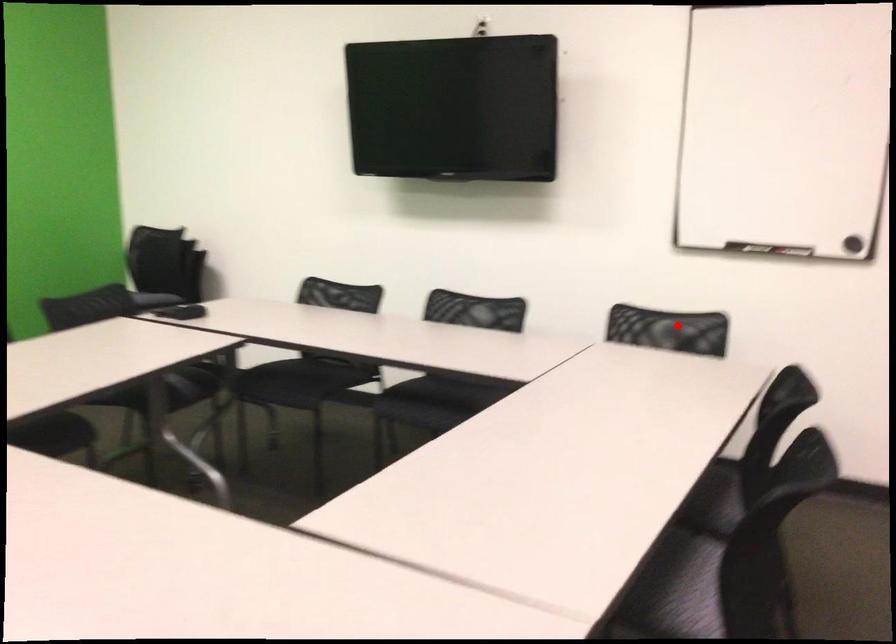
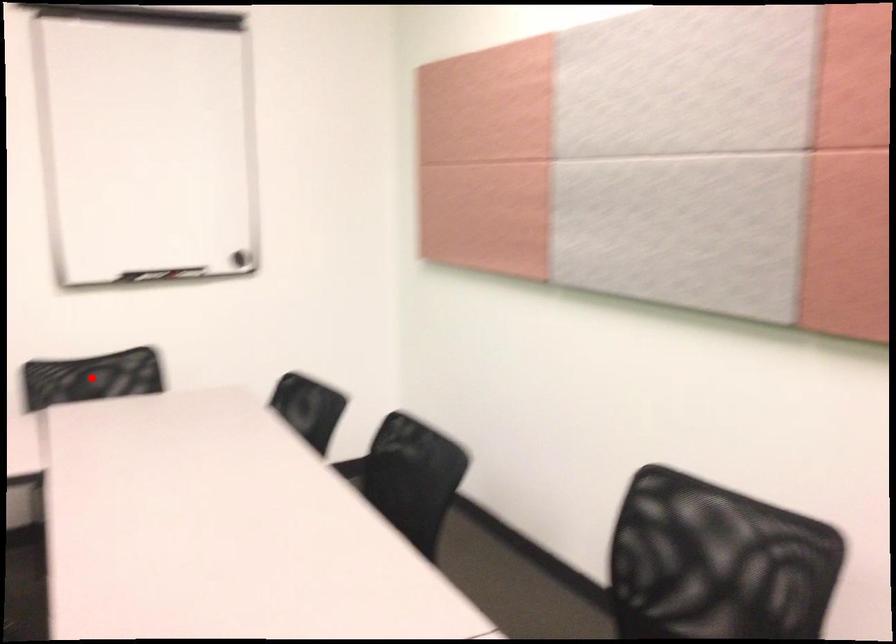
I am providing you with two images of the same scene from different viewpoints. A red point is marked on the first image and another point is marked on the second image. Does the point marked in image1 correspond to the same location as the one in image2?

Yes